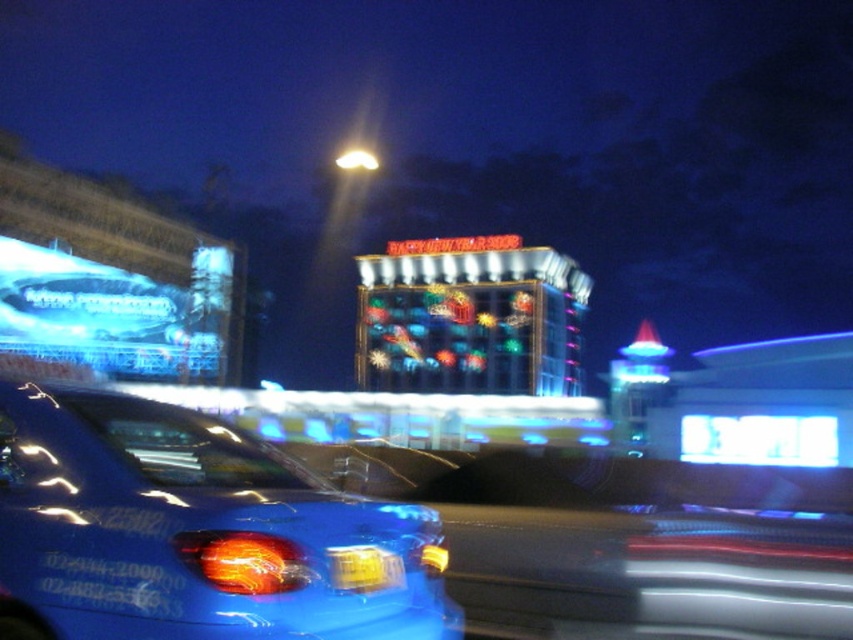
Question: Which point is closer to the camera?

Choices:
 (A) (223, 493)
 (B) (346, 564)

Answer: (B)

Question: Does glossy blue car at lower left lie behind yellow plastic license plate at center?

Choices:
 (A) yes
 (B) no

Answer: (B)

Question: From the image, what is the correct spatial relationship of glossy blue car at lower left in relation to yellow plastic license plate at center?

Choices:
 (A) left
 (B) right

Answer: (A)

Question: Can you confirm if glossy blue car at lower left is positioned below yellow plastic license plate at center?

Choices:
 (A) no
 (B) yes

Answer: (A)

Question: Among these points, which one is nearest to the camera?

Choices:
 (A) (361, 548)
 (B) (49, 576)

Answer: (B)

Question: Which point is closer to the camera?

Choices:
 (A) (218, 470)
 (B) (370, 573)

Answer: (B)